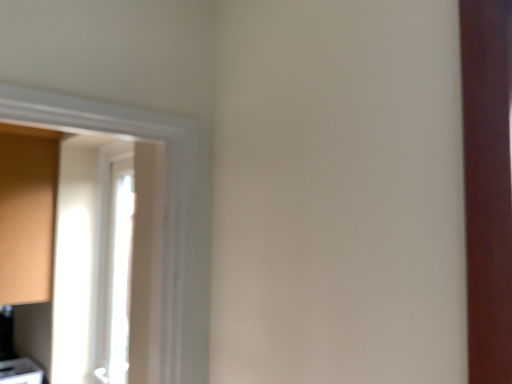
Question: From the image's perspective, is white glossy door at left above or below matte wood cabinet at left, placed as the second cabinetry when sorted from bottom to top?

Choices:
 (A) below
 (B) above

Answer: (A)

Question: In terms of height, does white glossy door at left look taller or shorter compared to matte wood cabinet at left, which ranks as the 1th cabinetry in top-to-bottom order?

Choices:
 (A) short
 (B) tall

Answer: (B)

Question: Considering the real-world distances, which object is farthest from the matte white cabinet at lower left, the second cabinetry positioned from the top?

Choices:
 (A) matte wood cabinet at left, which ranks as the 1th cabinetry in top-to-bottom order
 (B) white glossy door at left

Answer: (A)

Question: Which of these objects is positioned farthest from the white glossy door at left?

Choices:
 (A) matte wood cabinet at left, which ranks as the 1th cabinetry in top-to-bottom order
 (B) matte white cabinet at lower left, the second cabinetry positioned from the top

Answer: (B)